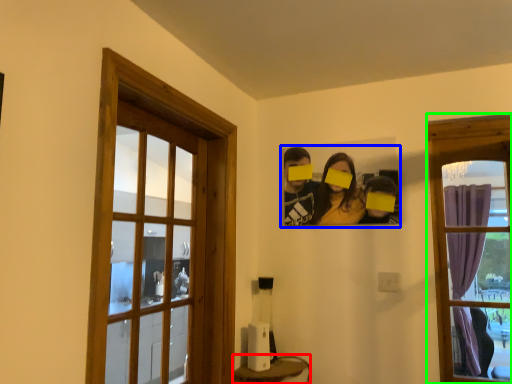
Question: Which object is the farthest from furniture (highlighted by a red box)? Choose among these: couple (highlighted by a blue box) or window (highlighted by a green box).

Choices:
 (A) couple
 (B) window

Answer: (B)